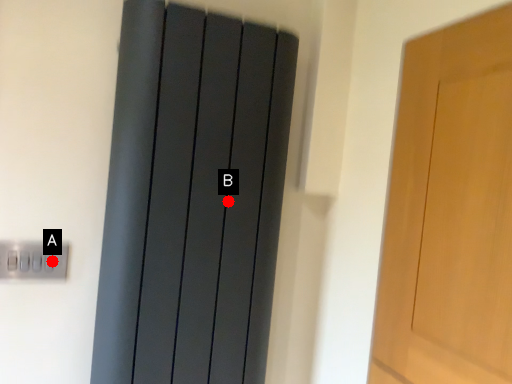
Question: Two points are circled on the image, labeled by A and B beside each circle. Which point is farther from the camera taking this photo?

Choices:
 (A) A is further
 (B) B is further

Answer: (B)